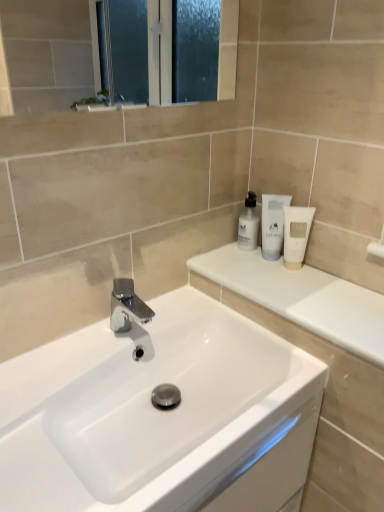
At what (x,y) coordinates should I click in order to perform the action: click on free space to the left of polished chrome tap at center. Please return your answer as a coordinate pair (x, y). Looking at the image, I should click on (67, 353).